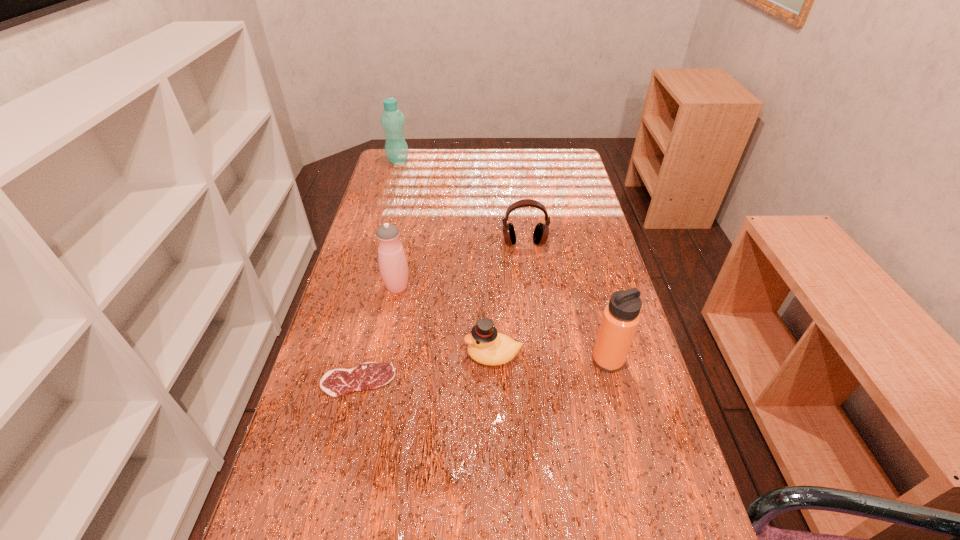
Locate an element on the screen. vacant space that satisfies the following two spatial constraints: 1. on the back side of the shortest object; 2. on the left side of the farther thermos bottle is located at coordinates (380, 287).

Locate an element on the screen. The width and height of the screenshot is (960, 540). blank space that satisfies the following two spatial constraints: 1. on the front-facing side of the duck; 2. on the back side of the rightmost object is located at coordinates (493, 360).